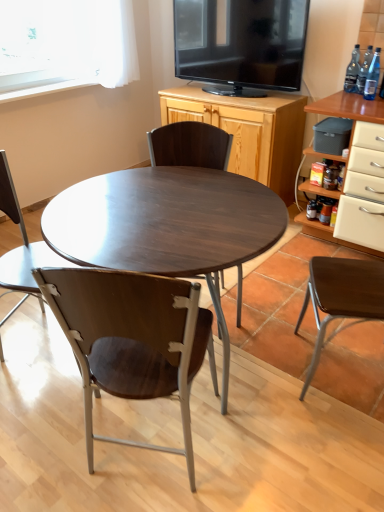
Find the location of `vacant region to the left of blue glass bottle at upper right, the 3th bottle positioned from the back`. vacant region to the left of blue glass bottle at upper right, the 3th bottle positioned from the back is located at coordinates (351, 97).